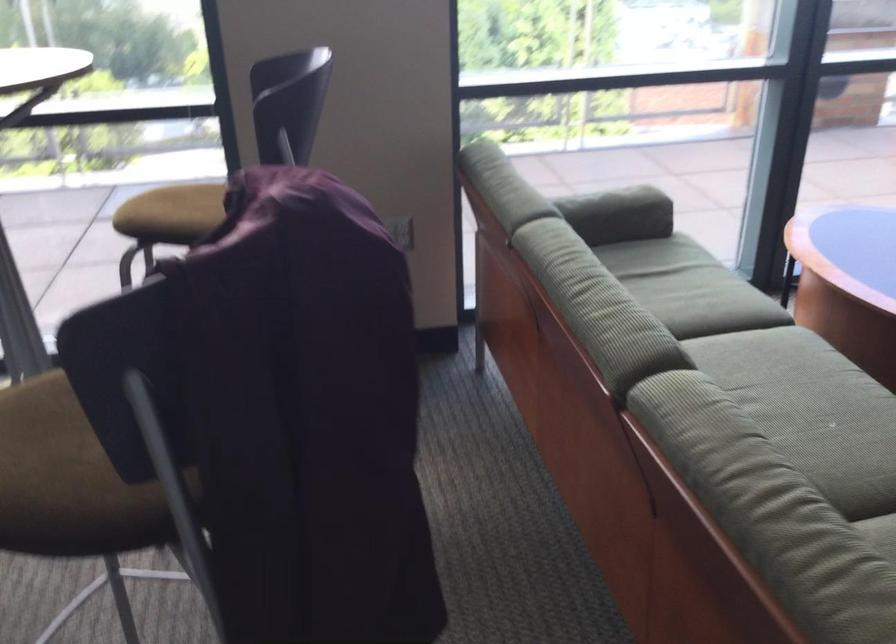
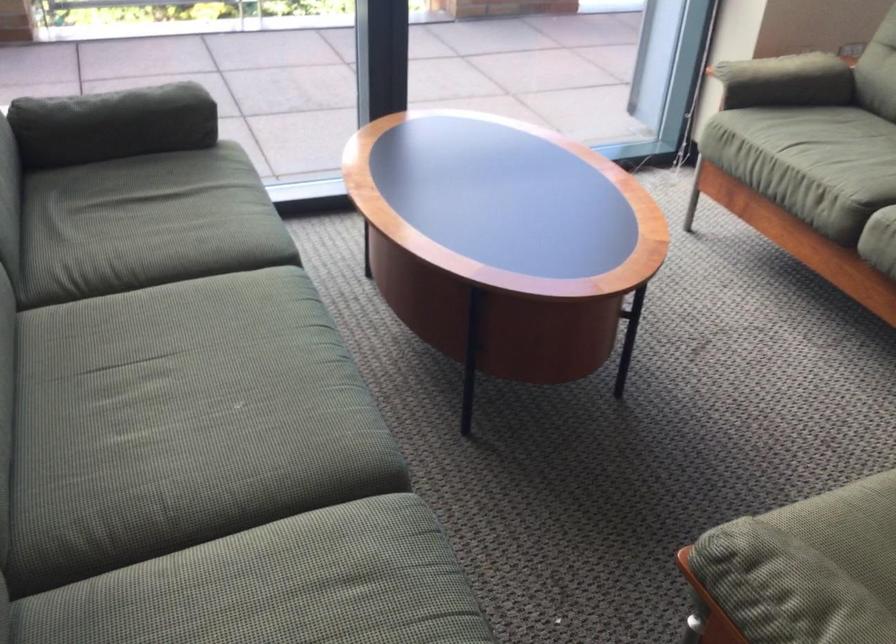
Question: How did the camera likely rotate?

Choices:
 (A) Left
 (B) Right
 (C) Up
 (D) Down

Answer: (B)